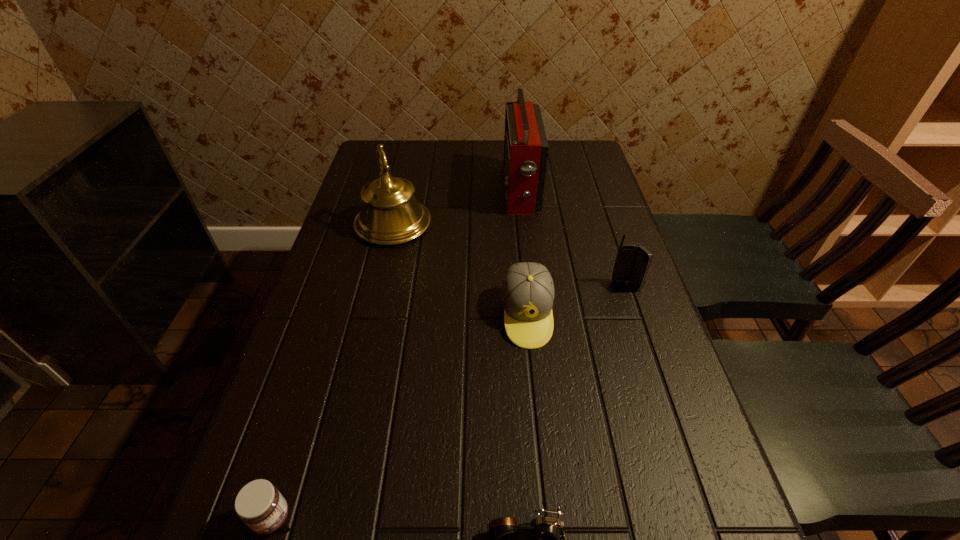
Locate an element on the screen. Image resolution: width=960 pixels, height=540 pixels. vacant space in between the bell and the baseball cap is located at coordinates (460, 269).

You are a GUI agent. You are given a task and a screenshot of the screen. Output one action in this format:
    pyautogui.click(x=<x>, y=<y>)
    Task: Click on the vacant region between the radio receiver and the bell
    
    Given the screenshot: What is the action you would take?
    pyautogui.click(x=456, y=207)

Identify the location of free space between the jam and the bell. tap(332, 371).

The image size is (960, 540). Identify the location of vacant space in between the radio receiver and the fourth tallest object. (523, 253).

In order to click on empty space that is in between the jam and the bell in this screenshot , I will do `click(332, 371)`.

I want to click on free space between the radio receiver and the jam, so click(396, 354).

Identify which object is the fourth closest to the fourth tallest object. Please provide its 2D coordinates. Your answer should be formatted as a tuple, i.e. [(x, y)], where the tuple contains the x and y coordinates of a point satisfying the conditions above.

[(549, 538)]

Image resolution: width=960 pixels, height=540 pixels. I want to click on object that stands as the closest to the goggles, so click(259, 504).

Image resolution: width=960 pixels, height=540 pixels. I want to click on blank area in the image that satisfies the following two spatial constraints: 1. on the front-facing side of the radio receiver; 2. on the front side of the bell, so click(524, 224).

You are a GUI agent. You are given a task and a screenshot of the screen. Output one action in this format:
    pyautogui.click(x=<x>, y=<y>)
    Task: Click on the free spot that satisfies the following two spatial constraints: 1. on the front-facing side of the radio receiver; 2. on the front label of the second shortest object
    The height and width of the screenshot is (540, 960).
    Given the screenshot: What is the action you would take?
    pyautogui.click(x=558, y=518)